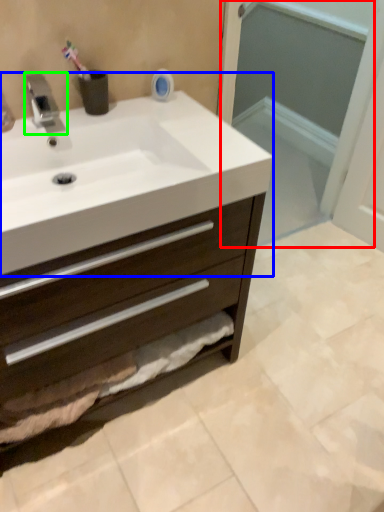
Question: Which object is the closest to the screen door (highlighted by a red box)? Choose among these: sink (highlighted by a blue box) or tap (highlighted by a green box).

Choices:
 (A) sink
 (B) tap

Answer: (A)